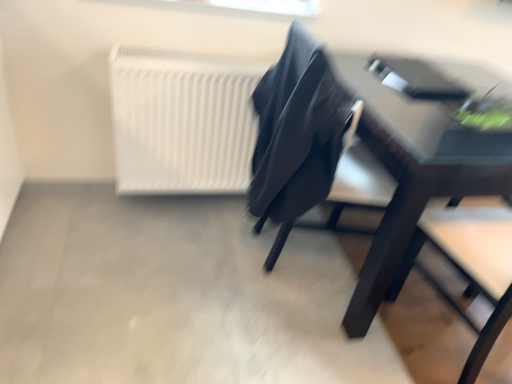
Question: Considering the relative sizes of matte black chair at center and matte black table at right in the image provided, is matte black chair at center bigger than matte black table at right?

Choices:
 (A) no
 (B) yes

Answer: (A)

Question: Are matte black chair at center and matte black table at right making contact?

Choices:
 (A) no
 (B) yes

Answer: (A)

Question: From a real-world perspective, is matte black chair at center physically above matte black table at right?

Choices:
 (A) yes
 (B) no

Answer: (A)

Question: From a real-world perspective, is matte black chair at center under matte black table at right?

Choices:
 (A) yes
 (B) no

Answer: (B)

Question: Considering the relative positions of matte black chair at center and matte black table at right in the image provided, is matte black chair at center in front of matte black table at right?

Choices:
 (A) yes
 (B) no

Answer: (B)

Question: From the image's perspective, is matte black chair at center on top of matte black table at right?

Choices:
 (A) no
 (B) yes

Answer: (B)

Question: From the image's perspective, does matte black chair at center appear lower than white matte radiator at upper left?

Choices:
 (A) no
 (B) yes

Answer: (B)

Question: Considering the relative sizes of matte black chair at center and white matte radiator at upper left in the image provided, is matte black chair at center shorter than white matte radiator at upper left?

Choices:
 (A) yes
 (B) no

Answer: (B)

Question: Is matte black chair at center further to camera compared to white matte radiator at upper left?

Choices:
 (A) no
 (B) yes

Answer: (A)

Question: Can you confirm if matte black chair at center is taller than white matte radiator at upper left?

Choices:
 (A) no
 (B) yes

Answer: (B)

Question: Is matte black chair at center not within white matte radiator at upper left?

Choices:
 (A) no
 (B) yes

Answer: (B)

Question: Is matte black chair at center facing towards white matte radiator at upper left?

Choices:
 (A) yes
 (B) no

Answer: (B)

Question: Is white matte radiator at upper left located outside matte black table at right?

Choices:
 (A) no
 (B) yes

Answer: (B)